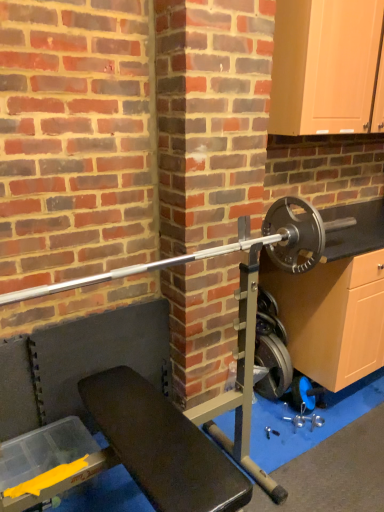
The height and width of the screenshot is (512, 384). Describe the element at coordinates (324, 66) in the screenshot. I see `matte wood cabinet at upper right` at that location.

Find the location of a particular element. matte wood cabinet at upper right is located at coordinates pyautogui.click(x=324, y=66).

Locate an element on the screen. This screenshot has width=384, height=512. matte wood cabinet at upper right is located at coordinates (324, 66).